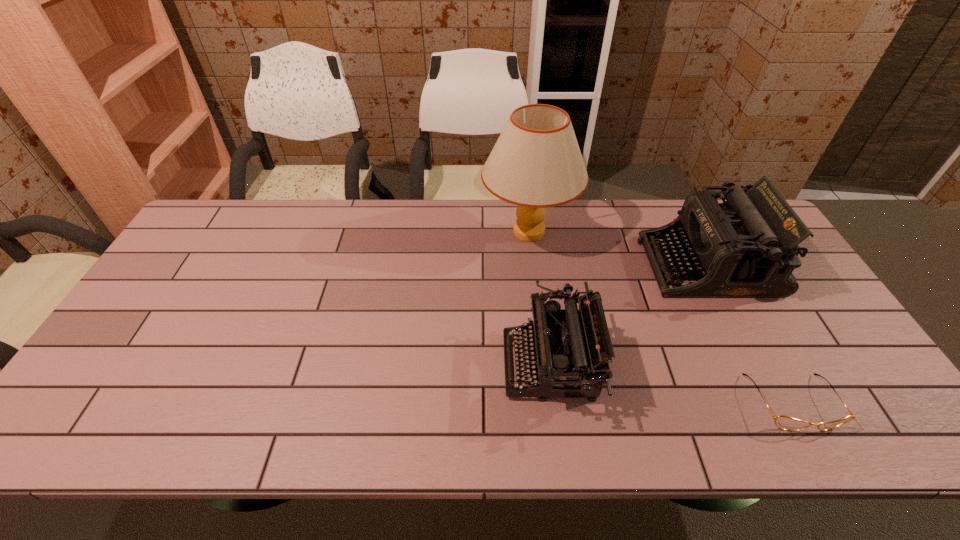
You are a GUI agent. You are given a task and a screenshot of the screen. Output one action in this format:
    pyautogui.click(x=<x>, y=<y>)
    Task: Click on the vacant space located 0.170m on the keyboard of the second shortest object
    The image size is (960, 540).
    Given the screenshot: What is the action you would take?
    pyautogui.click(x=436, y=365)

This screenshot has height=540, width=960. What are the coordinates of `vacant space located on the keyboard of the second shortest object` in the screenshot? It's located at (423, 365).

Find the location of a particular element. The width and height of the screenshot is (960, 540). free space located 0.380m on the keyboard of the second shortest object is located at coordinates (351, 365).

Identify the location of lampshade that is at the far edge. (536, 163).

Identify the location of typewriter located at the far edge. The width and height of the screenshot is (960, 540). [747, 247].

In order to click on typewriter that is at the near edge in this screenshot , I will do `click(570, 349)`.

Locate an element on the screen. Image resolution: width=960 pixels, height=540 pixels. spectacles at the near edge is located at coordinates (783, 422).

Find the location of a particular element. typewriter at the right edge is located at coordinates (747, 247).

Identify the location of spectacles located at the right edge. This screenshot has height=540, width=960. (783, 422).

Image resolution: width=960 pixels, height=540 pixels. I want to click on object located at the far right corner, so click(747, 247).